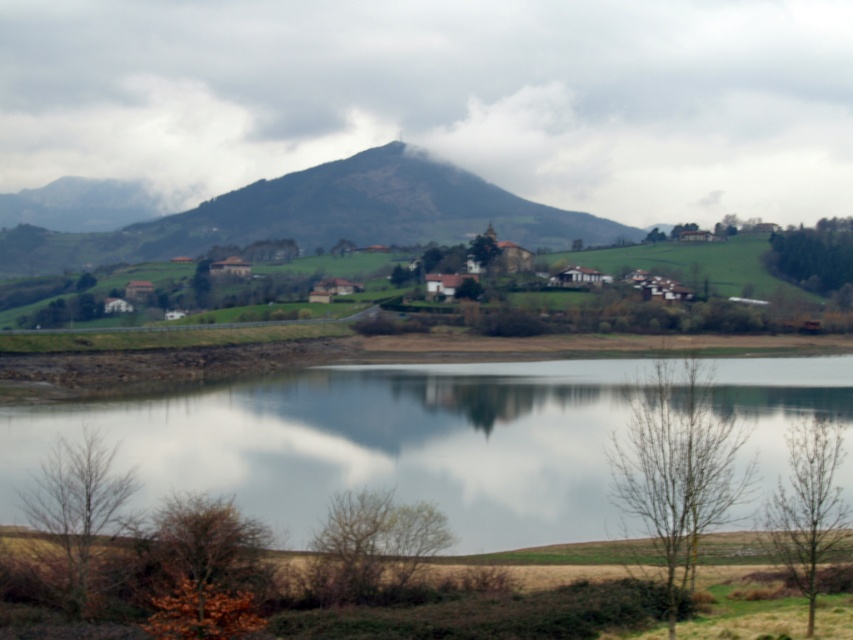
Can you confirm if bare branches at lower center is taller than green leafy tree at upper right?

No, bare branches at lower center is not taller than green leafy tree at upper right.

Does bare branches at lower center have a lesser width compared to green leafy tree at upper right?

Correct, bare branches at lower center's width is less than green leafy tree at upper right's.

Is point (361, 513) positioned after point (786, 276)?

That is False.

The image size is (853, 640). Identify the location of bare branches at lower center. (351, 545).

Which is in front, point (86, 92) or point (495, 243)?

Point (495, 243) is in front.

Find the location of `cloudy sky at center`. cloudy sky at center is located at coordinates (444, 99).

Is point (773, 102) more distant than point (474, 257)?

That is True.

Identify the location of cloudy sky at center. (444, 99).

Does brown leafy tree at lower left have a lesser width compared to green matte tree at center?

No.

Locate an element on the screen. brown leafy tree at lower left is located at coordinates (206, 568).